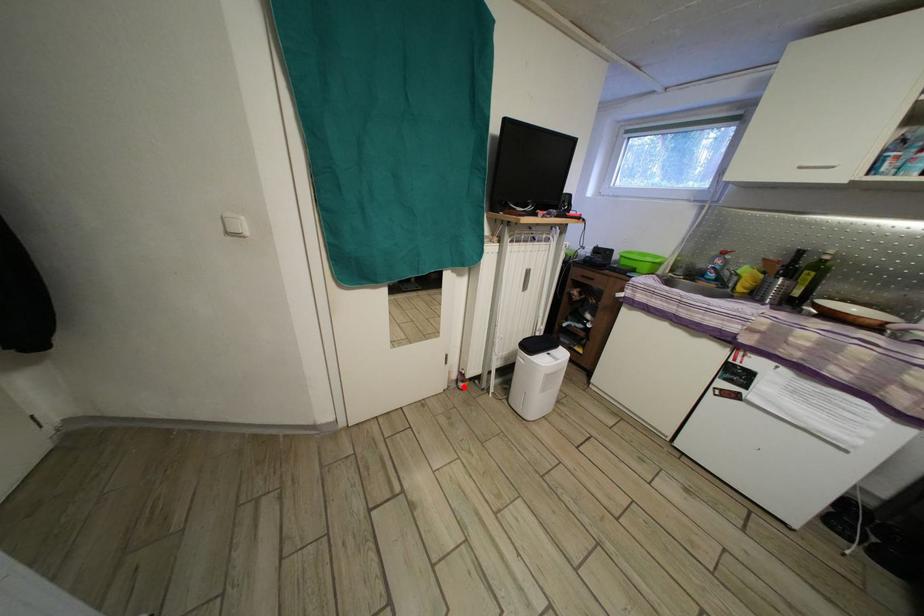
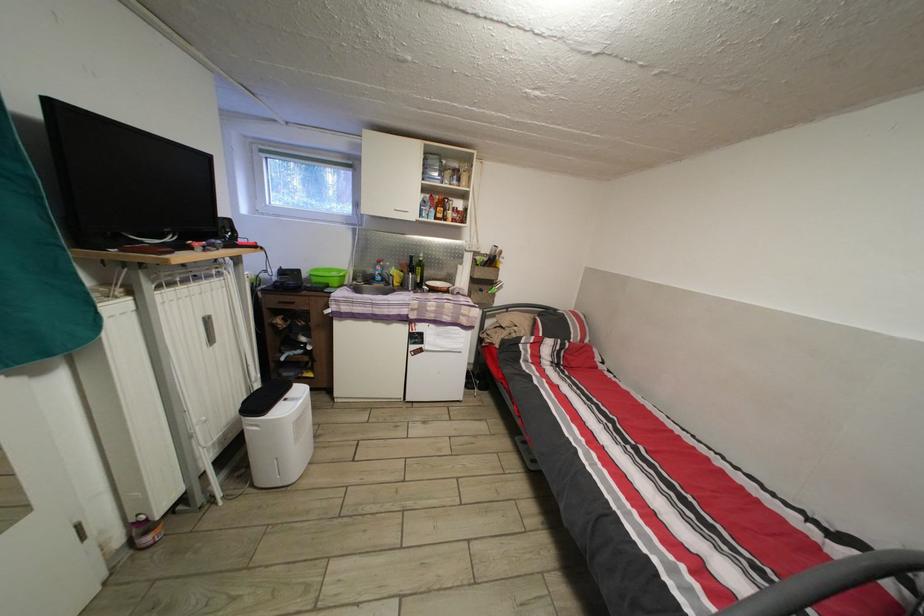
Question: I am providing you with two images of the same scene from different viewpoints. Given a red point in image1, look at the same physical point in image2. Is it:

Choices:
 (A) Closer to the viewpoint
 (B) Farther from the viewpoint

Answer: (A)